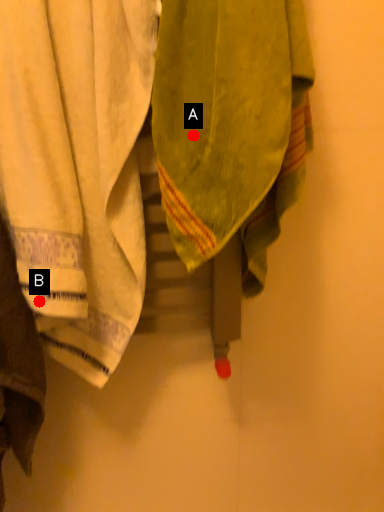
Question: Two points are circled on the image, labeled by A and B beside each circle. Which point is closer to the camera?

Choices:
 (A) A is closer
 (B) B is closer

Answer: (A)